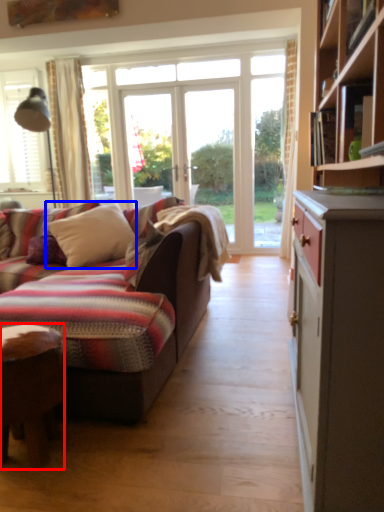
Question: Among these objects, which one is farthest to the camera, desk (highlighted by a red box) or pillow (highlighted by a blue box)?

Choices:
 (A) desk
 (B) pillow

Answer: (B)